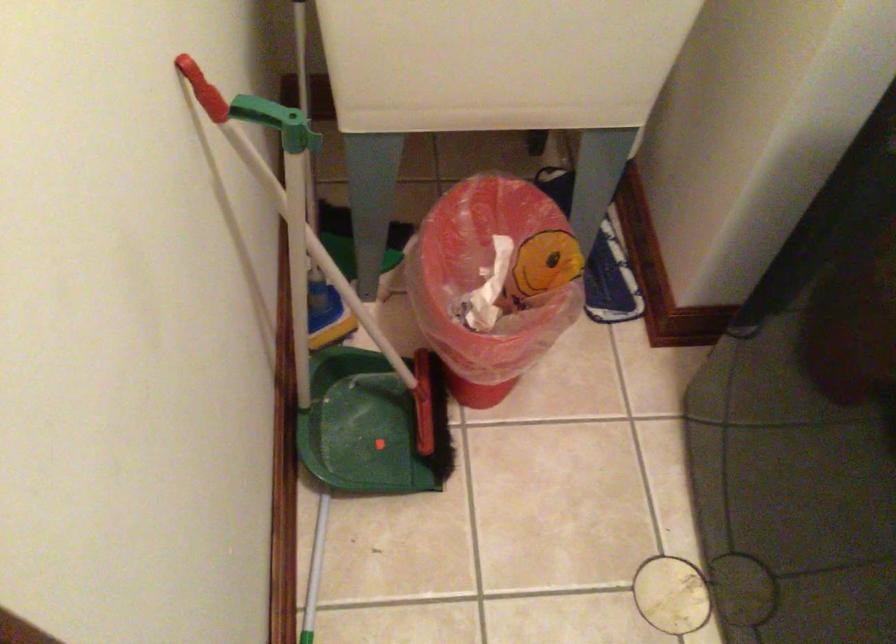
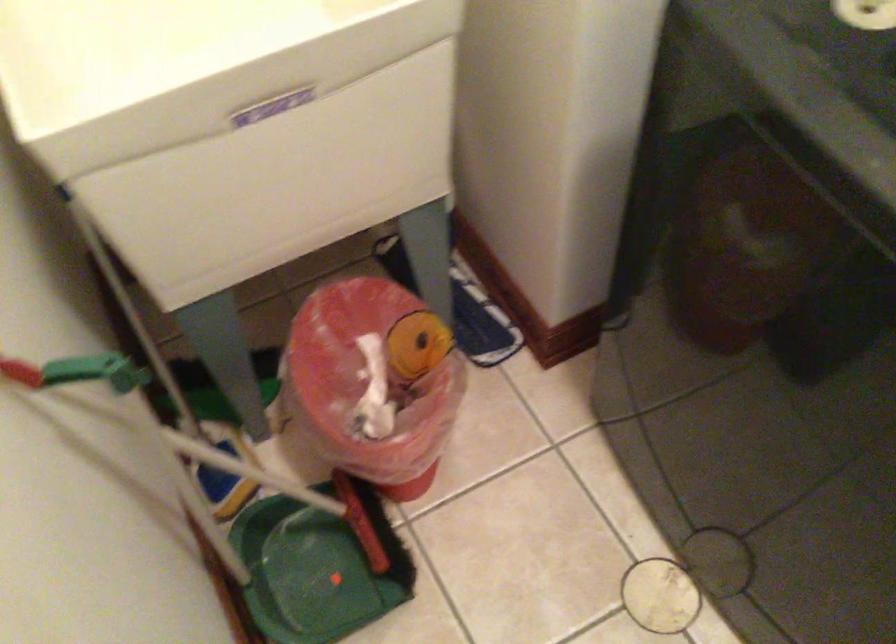
Question: What movement of the cameraman would produce the second image?

Choices:
 (A) Left
 (B) Right
 (C) Forward
 (D) Backward

Answer: (B)